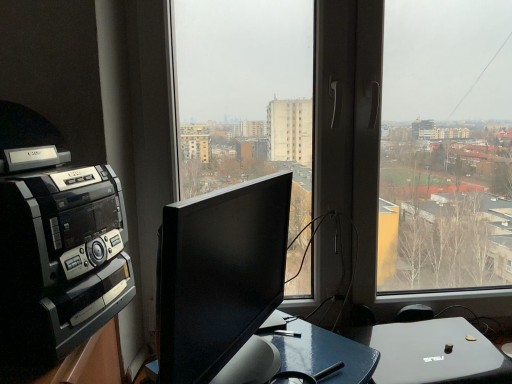
Question: From the image's perspective, is transparent glass window at center located above or below black glossy monitor at center?

Choices:
 (A) above
 (B) below

Answer: (A)

Question: From a real-world perspective, is transparent glass window at center physically located above or below black glossy monitor at center?

Choices:
 (A) above
 (B) below

Answer: (A)

Question: Considering the real-world distances, which object is farthest from the black plastic amplifier at left?

Choices:
 (A) black glossy monitor at center
 (B) transparent glass window at center

Answer: (B)

Question: Estimate the real-world distances between objects in this image. Which object is farther from the black plastic amplifier at left?

Choices:
 (A) black glossy monitor at center
 (B) transparent glass window at center

Answer: (B)